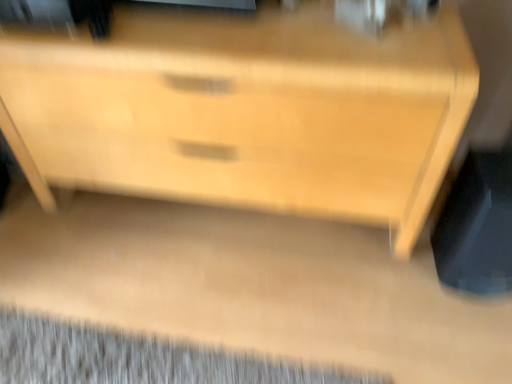
This screenshot has height=384, width=512. What are the coordinates of `free point above gray textured mat at lower left (from a real-world perspective)` in the screenshot? It's located at (142, 358).